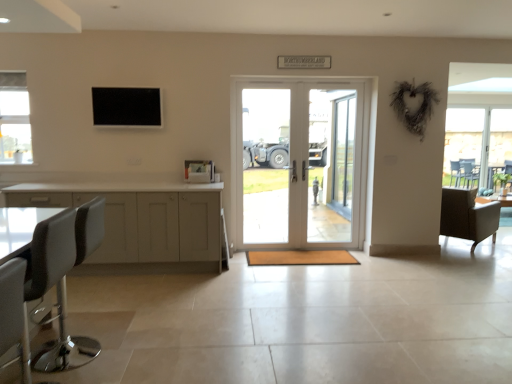
Question: Considering the relative positions of leather-like brown armchair at right, the first chair from the back, and white leather bar stool at left, which appears as the first chair when viewed from the front, in the image provided, is leather-like brown armchair at right, the first chair from the back, to the left of white leather bar stool at left, which appears as the first chair when viewed from the front, from the viewer's perspective?

Choices:
 (A) no
 (B) yes

Answer: (A)

Question: Considering the relative sizes of leather-like brown armchair at right, which appears as the second chair when viewed from the front, and white leather bar stool at left, positioned as the 2th chair in back-to-front order, in the image provided, is leather-like brown armchair at right, which appears as the second chair when viewed from the front, thinner than white leather bar stool at left, positioned as the 2th chair in back-to-front order,?

Choices:
 (A) no
 (B) yes

Answer: (A)

Question: From a real-world perspective, is leather-like brown armchair at right, the first chair from the back, positioned over white leather bar stool at left, positioned as the 1th chair in left-to-right order, based on gravity?

Choices:
 (A) no
 (B) yes

Answer: (A)

Question: Can you confirm if leather-like brown armchair at right, which appears as the second chair when viewed from the front, is taller than white leather bar stool at left, positioned as the 1th chair in left-to-right order?

Choices:
 (A) no
 (B) yes

Answer: (A)

Question: Does leather-like brown armchair at right, the first chair from the back, have a larger size compared to white leather bar stool at left, which appears as the first chair when viewed from the front?

Choices:
 (A) yes
 (B) no

Answer: (A)

Question: Is leather-like brown armchair at right, which appears as the second chair when viewed from the front, behind white leather bar stool at left, positioned as the 2th chair in right-to-left order?

Choices:
 (A) no
 (B) yes

Answer: (B)

Question: From a real-world perspective, is white leather bar stool at left, positioned as the 1th chair in left-to-right order, located beneath black leather swivel chair at lower left?

Choices:
 (A) no
 (B) yes

Answer: (B)

Question: Is white leather bar stool at left, positioned as the 2th chair in back-to-front order, positioned far away from black leather swivel chair at lower left?

Choices:
 (A) no
 (B) yes

Answer: (A)

Question: Considering the relative positions of white leather bar stool at left, positioned as the 1th chair in left-to-right order, and black leather swivel chair at lower left in the image provided, is white leather bar stool at left, positioned as the 1th chair in left-to-right order, in front of black leather swivel chair at lower left?

Choices:
 (A) no
 (B) yes

Answer: (A)

Question: Does white leather bar stool at left, which appears as the first chair when viewed from the front, come behind black leather swivel chair at lower left?

Choices:
 (A) no
 (B) yes

Answer: (B)

Question: Can you confirm if white leather bar stool at left, which appears as the first chair when viewed from the front, is taller than black leather swivel chair at lower left?

Choices:
 (A) no
 (B) yes

Answer: (A)

Question: Is white leather bar stool at left, positioned as the 1th chair in left-to-right order, looking in the opposite direction of black leather swivel chair at lower left?

Choices:
 (A) yes
 (B) no

Answer: (B)

Question: Is white leather bar stool at left, positioned as the 2th chair in right-to-left order, aimed at leather-like brown armchair at right, the first chair from the back?

Choices:
 (A) yes
 (B) no

Answer: (B)